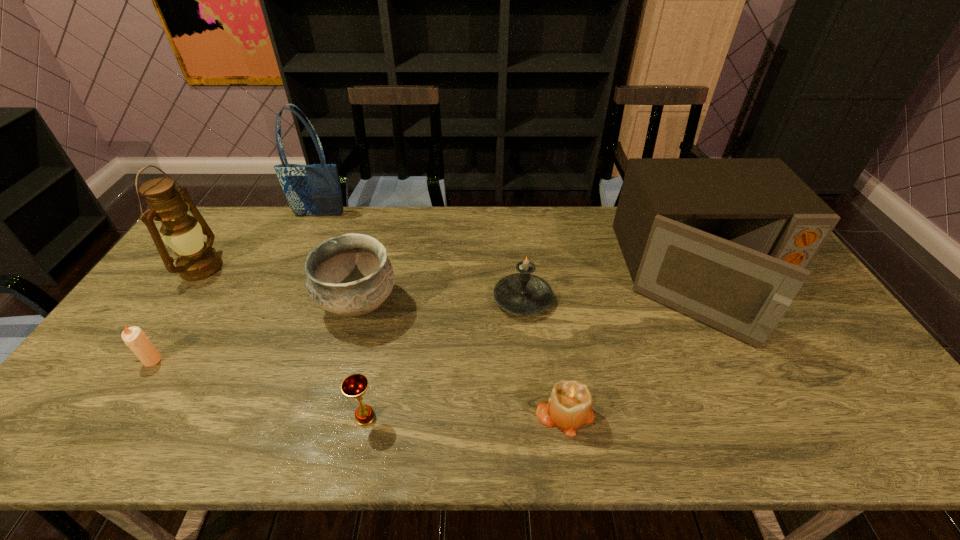
Point out which object is positioned as the second nearest to the nearest candle. Please provide its 2D coordinates. Your answer should be formatted as a tuple, i.e. [(x, y)], where the tuple contains the x and y coordinates of a point satisfying the conditions above.

[(522, 293)]

Choose which candle is the second nearest neighbor to the shopping bag. Please provide its 2D coordinates. Your answer should be formatted as a tuple, i.e. [(x, y)], where the tuple contains the x and y coordinates of a point satisfying the conditions above.

[(134, 337)]

Select which candle is the third closest to the microwave oven. Please provide its 2D coordinates. Your answer should be formatted as a tuple, i.e. [(x, y)], where the tuple contains the x and y coordinates of a point satisfying the conditions above.

[(134, 337)]

Where is `vacant area in the image that satisfies the following two spatial constraints: 1. on the front-facing side of the chalice; 2. on the right side of the sixth object from right to left`? This screenshot has height=540, width=960. vacant area in the image that satisfies the following two spatial constraints: 1. on the front-facing side of the chalice; 2. on the right side of the sixth object from right to left is located at coordinates (227, 417).

Find the location of `vacant space that satisfies the following two spatial constraints: 1. on the front side of the oil lamp; 2. on the right side of the pottery`. vacant space that satisfies the following two spatial constraints: 1. on the front side of the oil lamp; 2. on the right side of the pottery is located at coordinates (176, 305).

At what (x,y) coordinates should I click in order to perform the action: click on vacant space that satisfies the following two spatial constraints: 1. on the front-facing side of the nearest candle; 2. on the right side of the shopping bag. Please return your answer as a coordinate pair (x, y). Looking at the image, I should click on (228, 413).

Locate an element on the screen. The width and height of the screenshot is (960, 540). free location that satisfies the following two spatial constraints: 1. on the front side of the nearest candle; 2. on the left side of the leftmost candle is located at coordinates (118, 413).

You are a GUI agent. You are given a task and a screenshot of the screen. Output one action in this format:
    pyautogui.click(x=<x>, y=<y>)
    Task: Click on the free space that satisfies the following two spatial constraints: 1. on the front-facing side of the pottery; 2. on the left side of the farthest object
    The height and width of the screenshot is (540, 960).
    Given the screenshot: What is the action you would take?
    pyautogui.click(x=278, y=305)

This screenshot has height=540, width=960. What are the coordinates of `vacant position in the image that satisfies the following two spatial constraints: 1. on the front side of the nearest candle; 2. on the left side of the pottery` in the screenshot? It's located at (328, 413).

The image size is (960, 540). I want to click on free space that satisfies the following two spatial constraints: 1. on the front-facing side of the pottery; 2. on the left side of the shopping bag, so [278, 305].